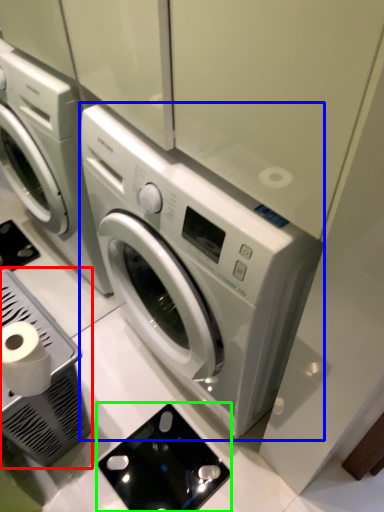
Question: Which object is positioned farthest from appliance (highlighted by a red box)? Select from washing machine (highlighted by a blue box) and appliance (highlighted by a green box).

Choices:
 (A) washing machine
 (B) appliance

Answer: (A)